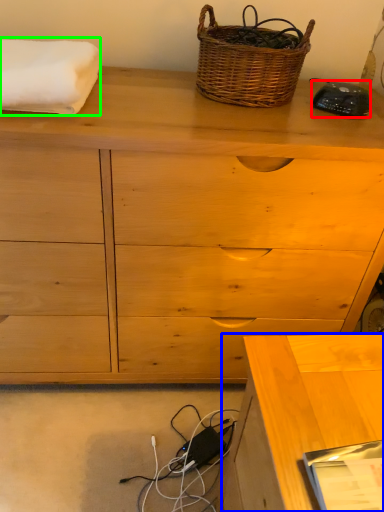
Question: Which object is the farthest from gadget (highlighted by a red box)? Choose among these: desk (highlighted by a blue box) or bath towel (highlighted by a green box).

Choices:
 (A) desk
 (B) bath towel

Answer: (A)